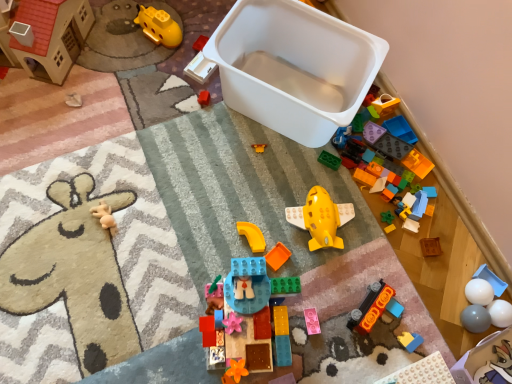
I want to click on vacant space situated on the left part of orange matte car at lower right, the 8th toy in the right-to-left sequence, so click(x=314, y=296).